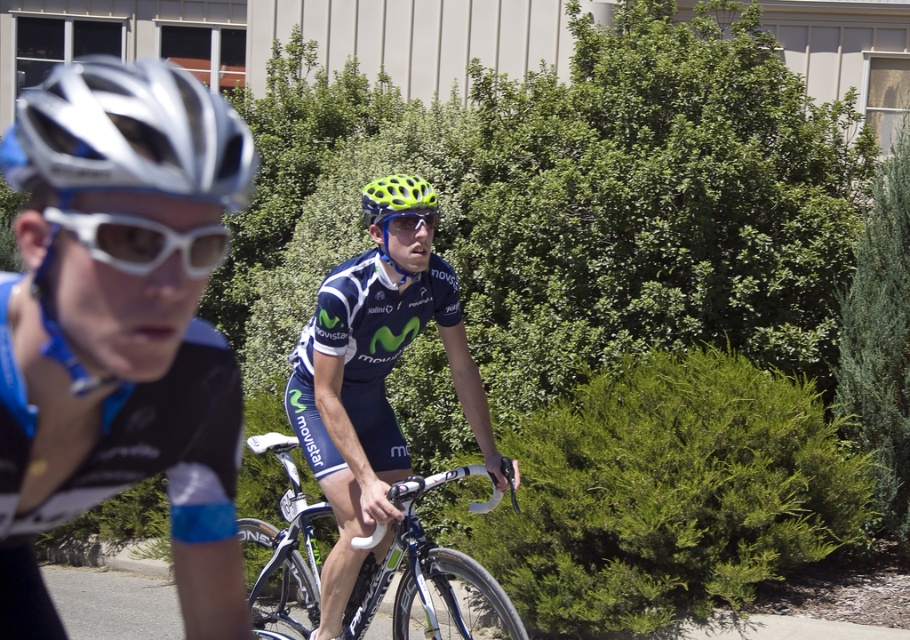
You are a photographer standing at the center of the image. You want to take a closeup shot of the silver metallic helmet at left. Which direction should you move to get closer to it?

The silver metallic helmet at left is located at point 0.211 on the x axis and 0.142 on the y axis. Since you are at the center, you should move to the left and slightly downward to reach the helmet.